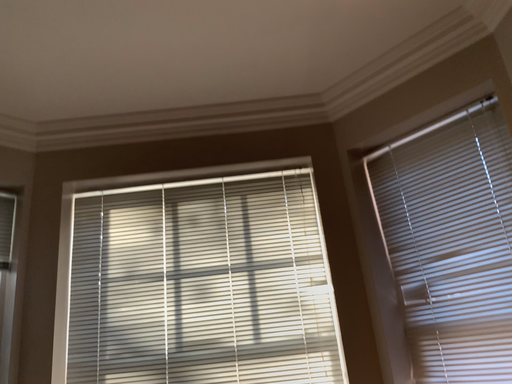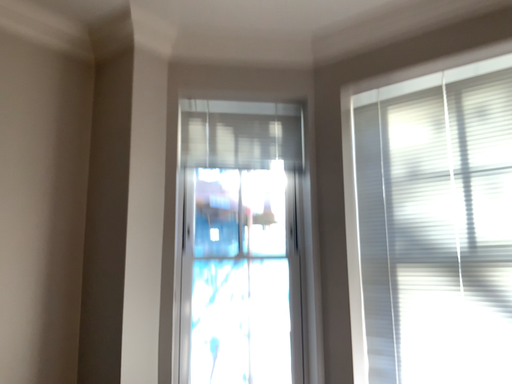
Question: How did the camera likely rotate when shooting the video?

Choices:
 (A) rotated downward
 (B) rotated upward

Answer: (A)